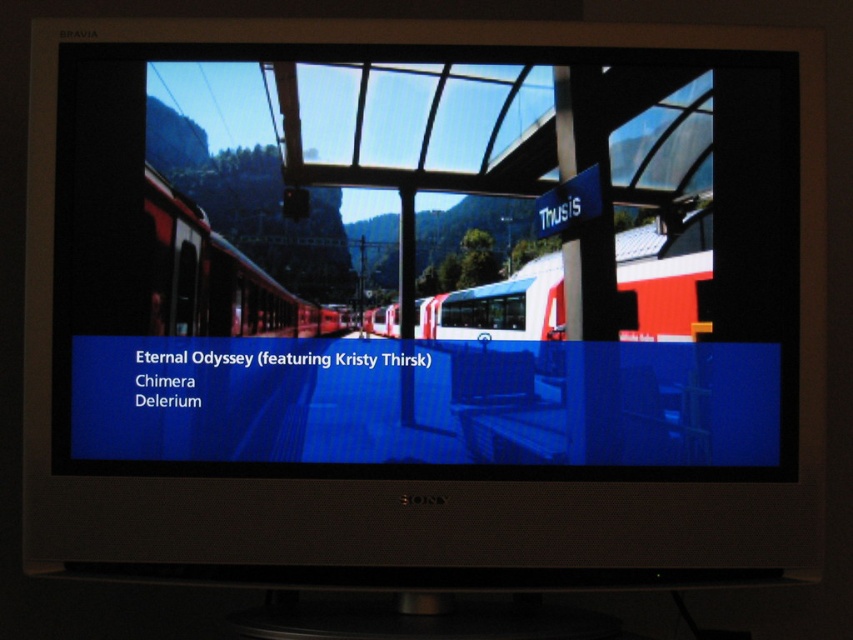
You are watching the TV show and notice two trains on the screen. The red matte train at center and the white glossy train at center. Which one appears nearer to you?

The red matte train at center is closer to the viewer than the white glossy train at center.

What is the length comparison between the white glossy train at center and the matte red train at left as displayed on the TV screen?

The white glossy train at center is shorter than the matte red train at left.

How does the width of the matte black screen at center compare to the white glossy train at center in the image?

The matte black screen at center is wider than the white glossy train at center.